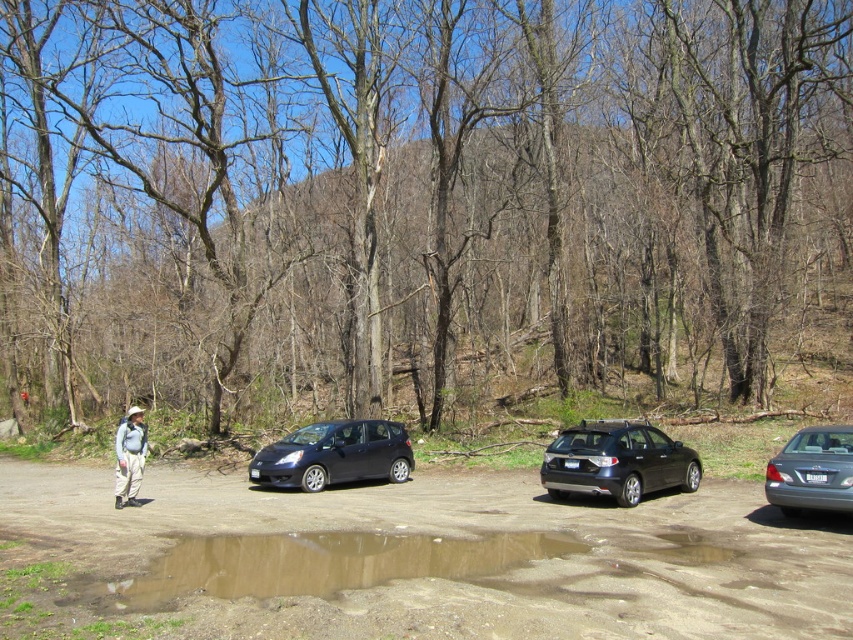
Consider the image. Which is more to the right, brown bark tree at center or brown dirt track at lower center?

Positioned to the right is brown bark tree at center.

Is point (19, 109) less distant than point (732, 572)?

No, (19, 109) is further to viewer.

The height and width of the screenshot is (640, 853). Describe the element at coordinates (415, 204) in the screenshot. I see `brown bark tree at center` at that location.

You are a GUI agent. You are given a task and a screenshot of the screen. Output one action in this format:
    pyautogui.click(x=<x>, y=<y>)
    Task: Click on the brown bark tree at center
    This screenshot has width=853, height=640.
    Given the screenshot: What is the action you would take?
    pyautogui.click(x=415, y=204)

Which is more to the right, matte black hatchback at center or satin silver sedan at right?

→ satin silver sedan at right

Is point (260, 474) positioned behind point (782, 506)?

Yes, point (260, 474) is farther from viewer.

Who is more forward, (274, 454) or (795, 460)?

Point (795, 460)

The width and height of the screenshot is (853, 640). Identify the location of matte black hatchback at center. (334, 454).

Which of these two, brown bark tree at center or shiny black hatchback at center, stands taller?

With more height is brown bark tree at center.

Between brown bark tree at center and shiny black hatchback at center, which one has less height?

Standing shorter between the two is shiny black hatchback at center.

Who is more distant from viewer, (688, 118) or (648, 442)?

Point (688, 118)

I want to click on brown bark tree at center, so click(415, 204).